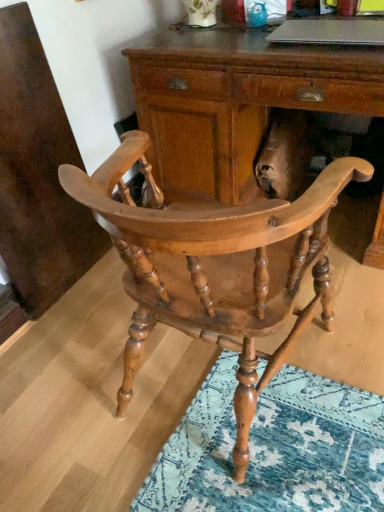
Question: Considering their positions, is wooden desk at center located in front of or behind natural wood chair at center?

Choices:
 (A) behind
 (B) front

Answer: (A)

Question: From the image's perspective, is wooden desk at center positioned above or below natural wood chair at center?

Choices:
 (A) above
 (B) below

Answer: (A)

Question: Estimate the real-world distances between objects in this image. Which object is farther from the silver metallic laptop at upper center?

Choices:
 (A) wooden desk at center
 (B) natural wood chair at center

Answer: (B)

Question: Considering the real-world distances, which object is closest to the silver metallic laptop at upper center?

Choices:
 (A) wooden desk at center
 (B) natural wood chair at center

Answer: (A)